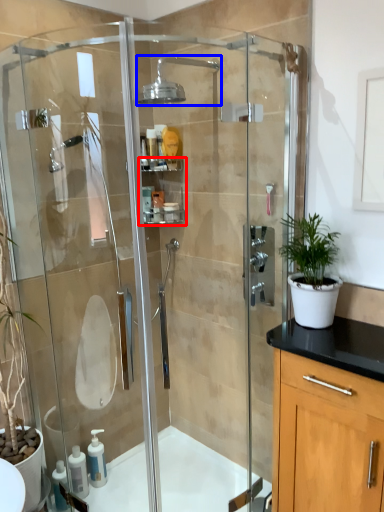
Question: Which point is closer to the camera, shelf (highlighted by a red box) or shower (highlighted by a blue box)?

Choices:
 (A) shelf
 (B) shower

Answer: (B)